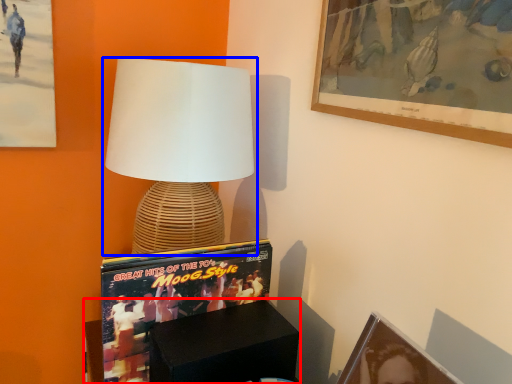
Question: Which object appears farthest to the camera in this image, furniture (highlighted by a red box) or lamp (highlighted by a blue box)?

Choices:
 (A) furniture
 (B) lamp

Answer: (B)